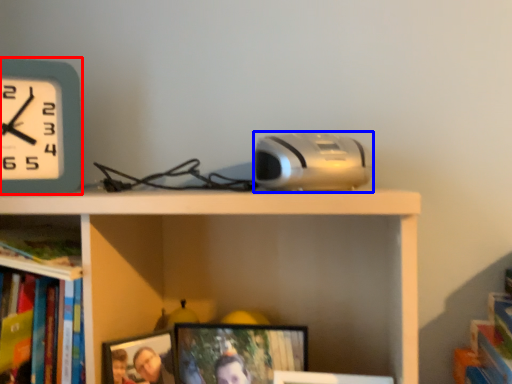
Question: Which point is closer to the camera, wall clock (highlighted by a red box) or gadget (highlighted by a blue box)?

Choices:
 (A) wall clock
 (B) gadget

Answer: (B)